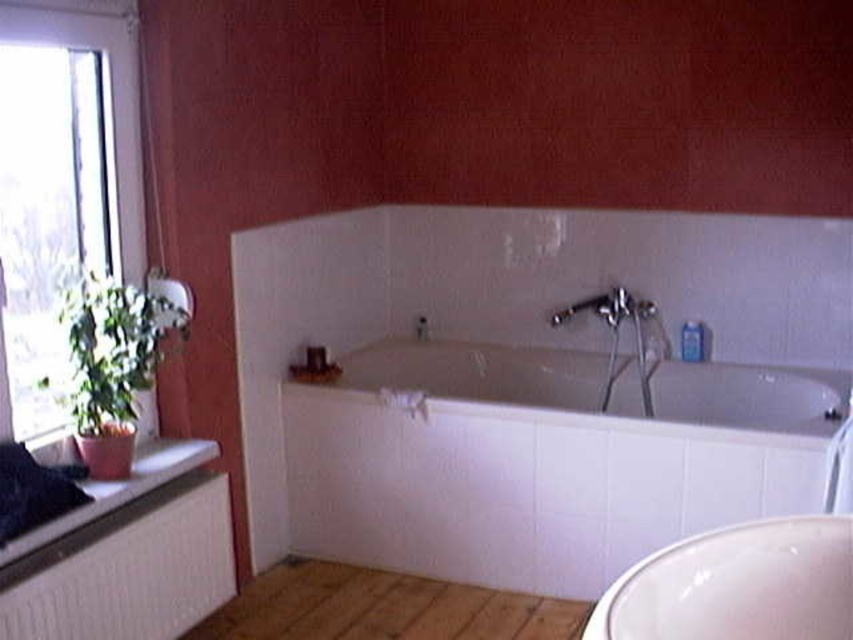
You are a painter standing in the bathroom and want to paint the wall behind the transparent glass window at left and the matte silver faucet at center. Which object is closer to the left wall?

The transparent glass window at left is closer to the left wall than the matte silver faucet at center because it is positioned to the left of the faucet.

You are a home inspector assessing the bathroom layout. You need to determine if a 1.5 meter tall ladder can fit vertically between the white glossy bathtub at center and the white glossy sink at lower right. Can it fit?

The white glossy bathtub at center is taller than the white glossy sink at lower right. Since the ladder is 1.5 meters tall, it cannot fit vertically between them as the height between the two objects is limited by the taller bathtub.

You are a painter standing in the bathroom and want to paint the wall behind the transparent glass window at left and the matte silver faucet at center. Which object is higher up on the wall?

The transparent glass window at left is located above the matte silver faucet at center, so the transparent glass window at left is higher up on the wall.